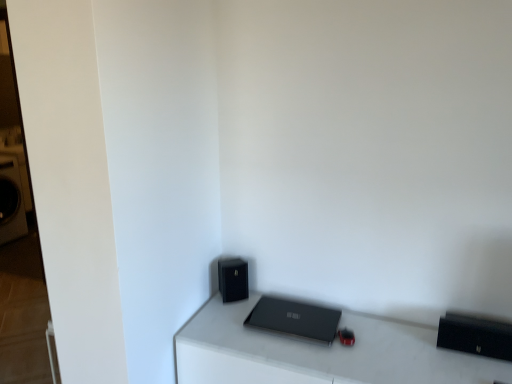
Where is `vacant space to the left of matte black laptop at center`? vacant space to the left of matte black laptop at center is located at coordinates (228, 328).